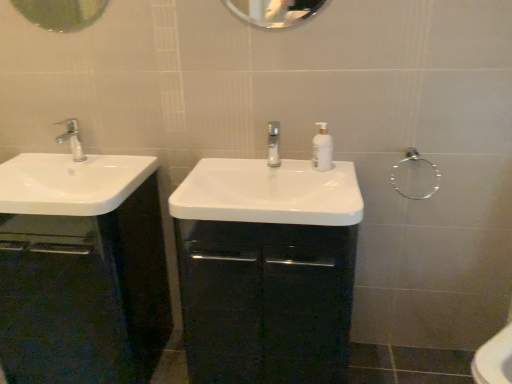
You are a GUI agent. You are given a task and a screenshot of the screen. Output one action in this format:
    pyautogui.click(x=<x>, y=<y>)
    Task: Click on the vacant region to the right of clear glass tap at center, the 2th tap positioned from the left
    
    Given the screenshot: What is the action you would take?
    pyautogui.click(x=310, y=183)